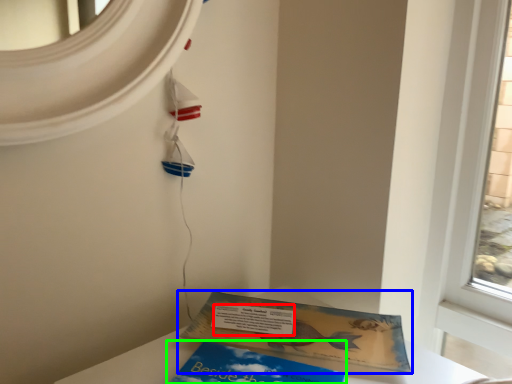
Question: Which object is the farthest from writing (highlighted by a red box)? Choose among these: book (highlighted by a blue box) or book (highlighted by a green box).

Choices:
 (A) book
 (B) book

Answer: (B)